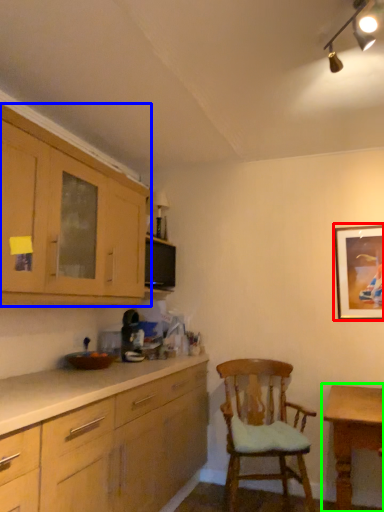
Question: Based on their relative distances, which object is nearer to picture frame (highlighted by a red box)? Choose from cabinetry (highlighted by a blue box) and table (highlighted by a green box).

Choices:
 (A) cabinetry
 (B) table

Answer: (B)